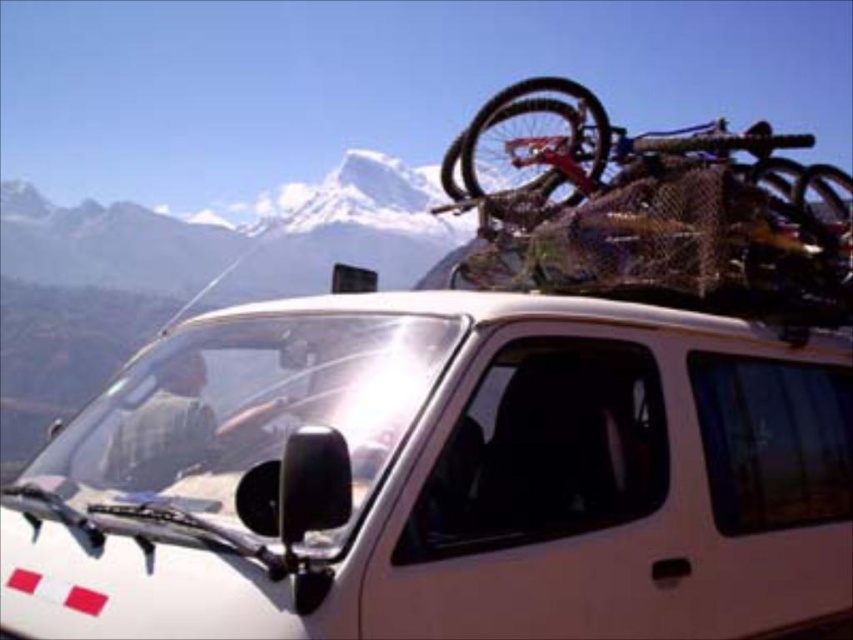
Question: Is white matte van at center to the right of shiny metallic bicycle at top right from the viewer's perspective?

Choices:
 (A) yes
 (B) no

Answer: (B)

Question: Can you confirm if white matte van at center is smaller than shiny metallic bicycle at top right?

Choices:
 (A) yes
 (B) no

Answer: (B)

Question: From the image, what is the correct spatial relationship of white matte van at center in relation to shiny metallic bicycle at top right?

Choices:
 (A) above
 (B) below

Answer: (B)

Question: Which point is farther from the camera taking this photo?

Choices:
 (A) (616, 474)
 (B) (581, 284)

Answer: (B)